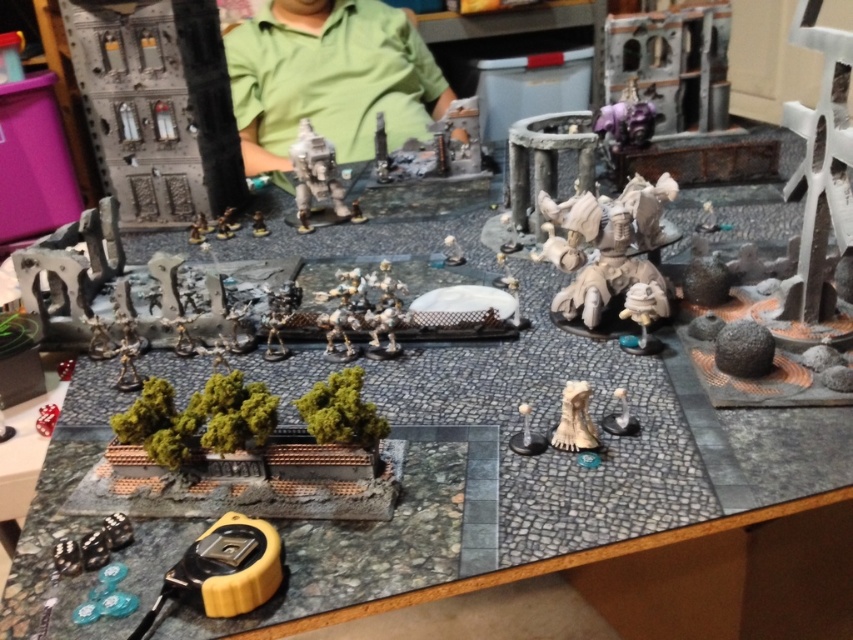
Does purple metallic armor at upper right appear on the right side of metallic silver miniature at center-left?

Yes, purple metallic armor at upper right is to the right of metallic silver miniature at center-left.

Can you confirm if purple metallic armor at upper right is wider than metallic silver miniature at center-left?

Indeed, purple metallic armor at upper right has a greater width compared to metallic silver miniature at center-left.

Measure the distance between purple metallic armor at upper right and camera.

The distance of purple metallic armor at upper right from camera is 5.11 feet.

The image size is (853, 640). What are the coordinates of `purple metallic armor at upper right` in the screenshot? It's located at (627, 120).

Which of these two, green matte shirt at center or metallic silver miniature at center, stands taller?

green matte shirt at center is taller.

Describe the element at coordinates (329, 77) in the screenshot. I see `green matte shirt at center` at that location.

Find the location of a particular element. Image resolution: width=853 pixels, height=640 pixels. green matte shirt at center is located at coordinates (329, 77).

Does yellow rubber tape measure at lower left have a greater width compared to white matte miniature at center?

Yes, yellow rubber tape measure at lower left is wider than white matte miniature at center.

Between point (235, 529) and point (445, 237), which one is positioned in front?

Positioned in front is point (235, 529).

Locate an element on the screen. Image resolution: width=853 pixels, height=640 pixels. yellow rubber tape measure at lower left is located at coordinates (224, 570).

The width and height of the screenshot is (853, 640). I want to click on yellow rubber tape measure at lower left, so click(224, 570).